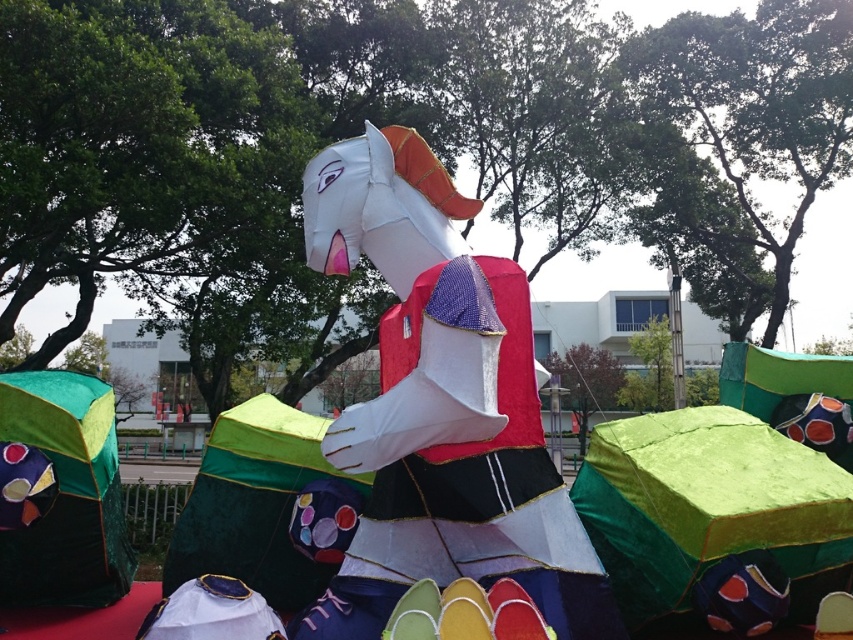
Question: Which object appears closest to the camera in this image?

Choices:
 (A) matte paper horse at center
 (B) green fabric umbrella at lower left

Answer: (A)

Question: Is matte paper horse at center closer to camera compared to green fabric umbrella at lower left?

Choices:
 (A) no
 (B) yes

Answer: (B)

Question: Which point appears farthest from the camera in this image?

Choices:
 (A) (38, 483)
 (B) (339, 241)

Answer: (A)

Question: Does matte paper horse at center appear on the left side of green fabric umbrella at lower left?

Choices:
 (A) no
 (B) yes

Answer: (A)

Question: Is matte paper horse at center below green fabric umbrella at lower left?

Choices:
 (A) no
 (B) yes

Answer: (A)